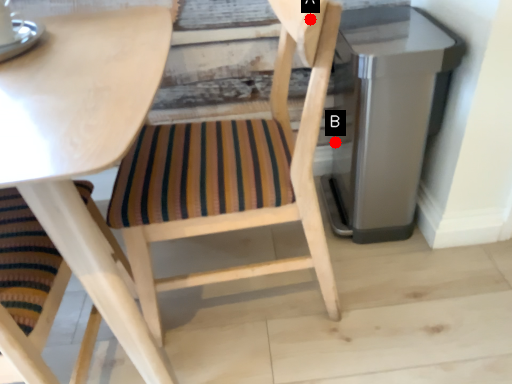
Question: Two points are circled on the image, labeled by A and B beside each circle. Which of the following is the farthest from the observer?

Choices:
 (A) A is further
 (B) B is further

Answer: (B)